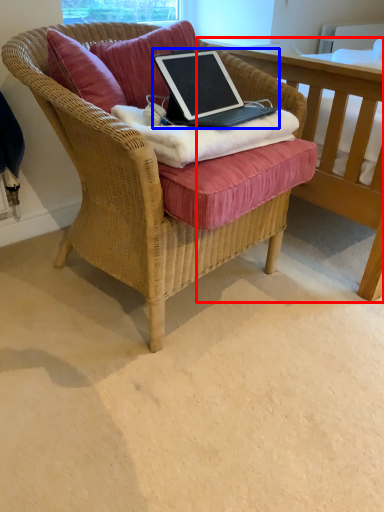
Question: Which object is further to the camera taking this photo, table (highlighted by a red box) or laptop (highlighted by a blue box)?

Choices:
 (A) table
 (B) laptop

Answer: (A)